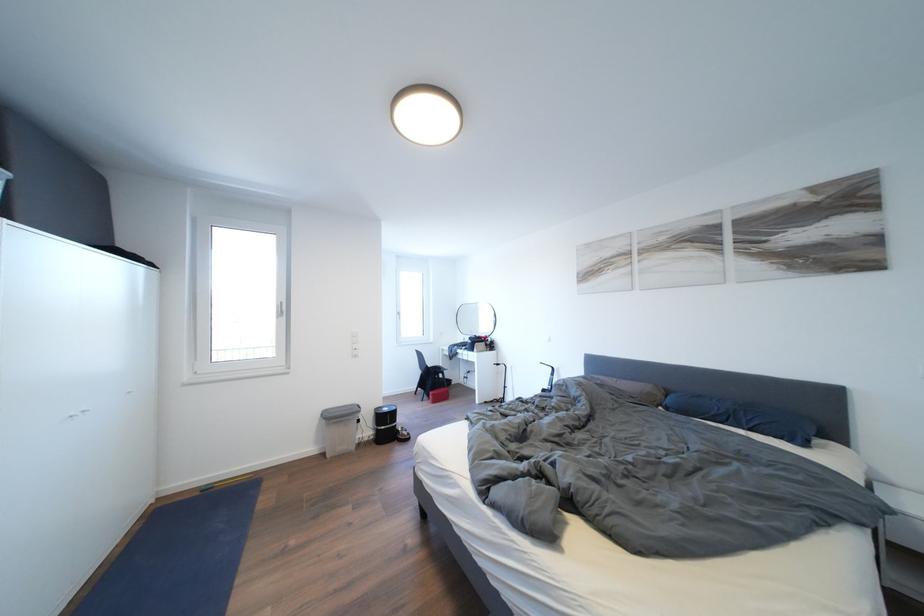
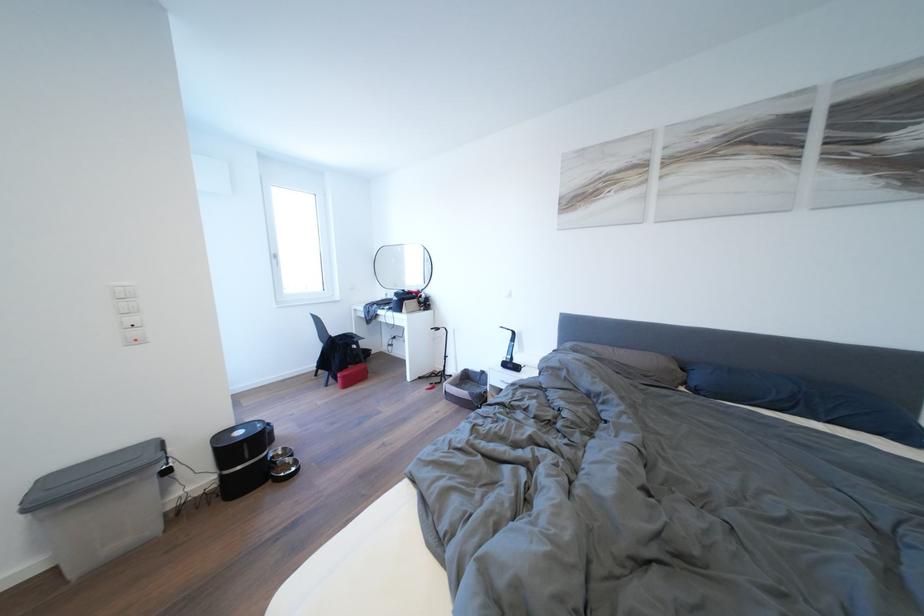
Question: I am providing you with two images of the same scene from different viewpoints. Which of the following objects are not visible in image2?

Choices:
 (A) grey bin lid
 (B) black pet feeder
 (C) white wall switch
 (D) none of these

Answer: (D)